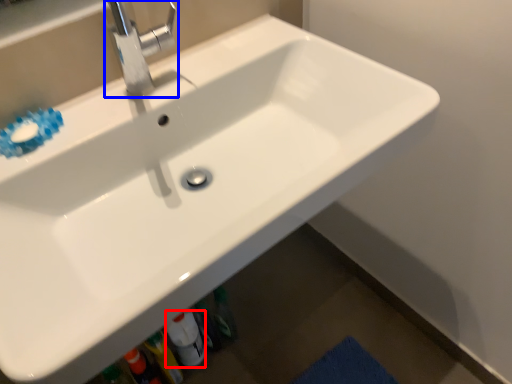
Question: Which point is further to the camera, bottle (highlighted by a red box) or tap (highlighted by a blue box)?

Choices:
 (A) bottle
 (B) tap

Answer: (A)